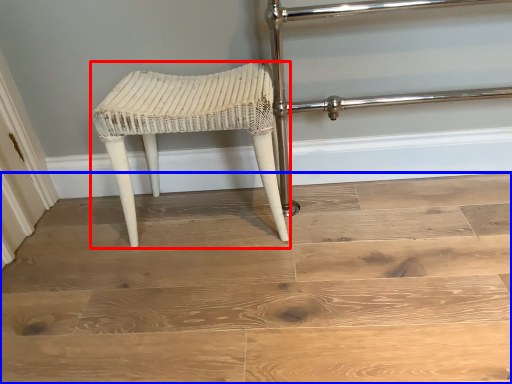
Question: Among these objects, which one is nearest to the camera, stool (highlighted by a red box) or stairwell (highlighted by a blue box)?

Choices:
 (A) stool
 (B) stairwell

Answer: (B)